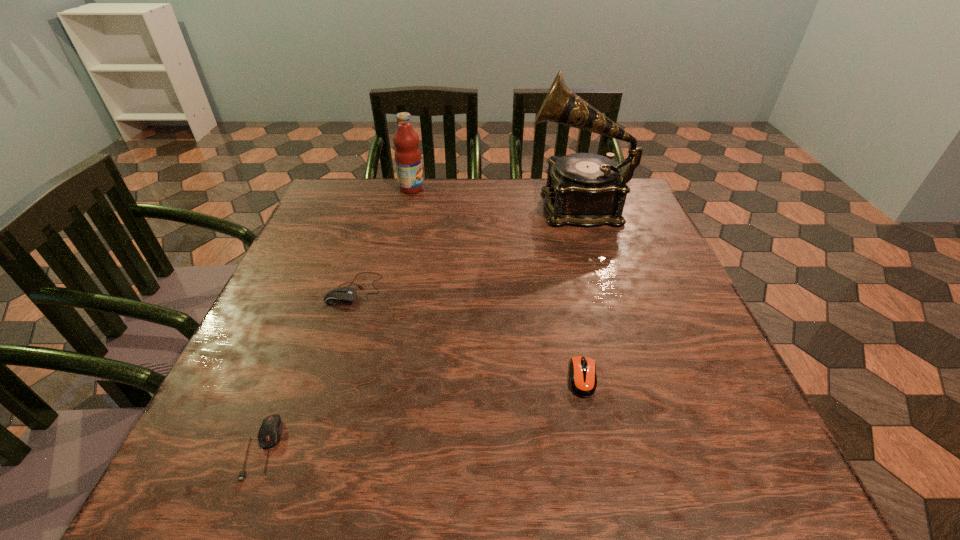
In the image, there is a desktop. Where is `vacant space at the left edge`? The image size is (960, 540). vacant space at the left edge is located at coordinates pyautogui.click(x=337, y=327).

Image resolution: width=960 pixels, height=540 pixels. In the image, there is a desktop. In order to click on vacant space at the right edge in this screenshot , I will do `click(692, 326)`.

Locate an element on the screen. The image size is (960, 540). vacant region at the far left corner of the desktop is located at coordinates (324, 202).

Locate an element on the screen. The width and height of the screenshot is (960, 540). free space at the near left corner is located at coordinates (205, 453).

In the image, there is a desktop. At what (x,y) coordinates should I click in order to perform the action: click on free space at the near right corner. Please return your answer as a coordinate pair (x, y). Image resolution: width=960 pixels, height=540 pixels. Looking at the image, I should click on (768, 462).

What are the coordinates of `free point between the rightmost mouse and the nearest mouse` in the screenshot? It's located at [x=423, y=413].

Where is `free space between the fruit juice and the nearest object`? free space between the fruit juice and the nearest object is located at coordinates (337, 318).

You are a GUI agent. You are given a task and a screenshot of the screen. Output one action in this format:
    pyautogui.click(x=<x>, y=<y>)
    Task: Click on the unoccupied area between the fruit juice and the tallest object
    Image resolution: width=960 pixels, height=540 pixels.
    Given the screenshot: What is the action you would take?
    pyautogui.click(x=494, y=197)

At what (x,y) coordinates should I click in order to perform the action: click on vacant region between the second nearest mouse and the fruit juice. Please return your answer as a coordinate pair (x, y). Looking at the image, I should click on (497, 283).

I want to click on free spot between the third nearest object and the second farthest mouse, so click(468, 333).